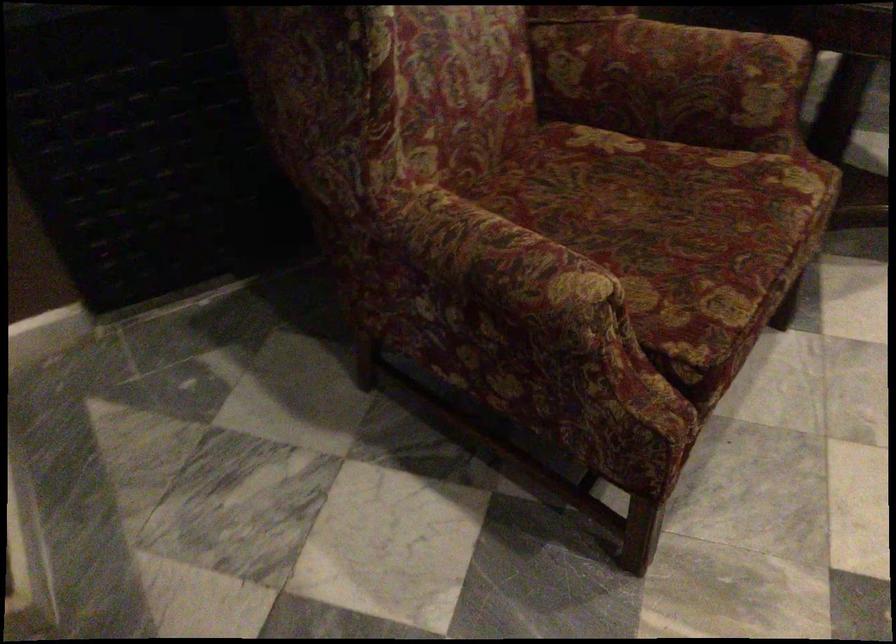
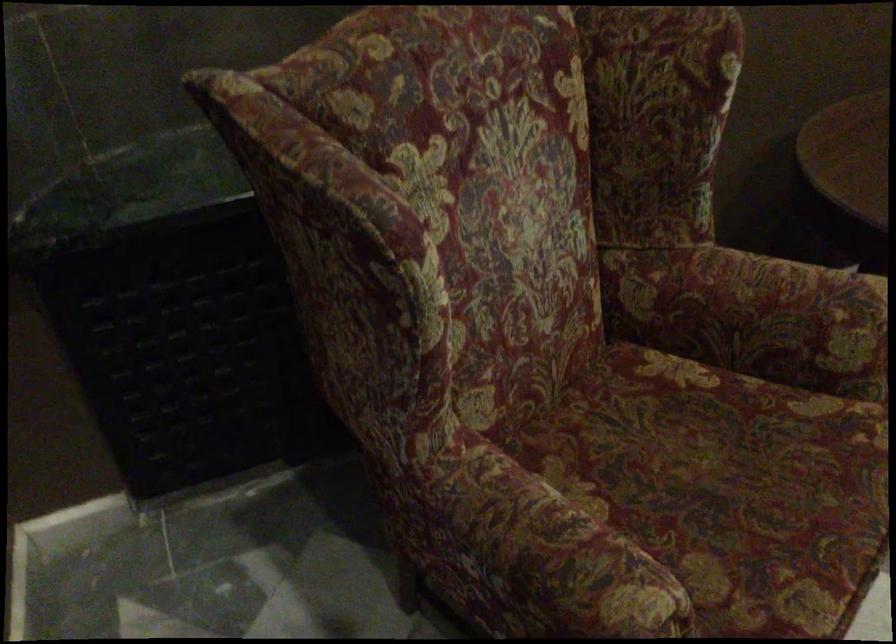
Find the pixel in the second image that matches the point at 707,84 in the first image.

(786, 321)